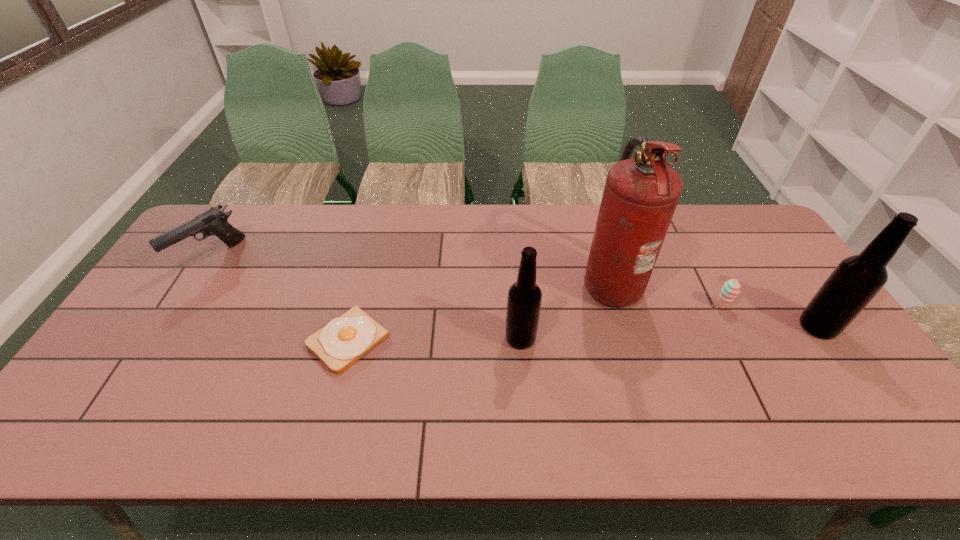
The image size is (960, 540). Find the location of `vacant region between the third tallest object and the fifth object from left to right`. vacant region between the third tallest object and the fifth object from left to right is located at coordinates (621, 322).

Image resolution: width=960 pixels, height=540 pixels. Find the location of `empty location between the toast and the third shortest object`. empty location between the toast and the third shortest object is located at coordinates (279, 299).

Locate an element on the screen. free space between the left beer bottle and the third shortest object is located at coordinates (366, 298).

The width and height of the screenshot is (960, 540). In order to click on vacant area that lies between the left beer bottle and the shortest object in this screenshot , I will do `click(434, 340)`.

Find the location of a particular element. Image resolution: width=960 pixels, height=540 pixels. free space between the tallest object and the left beer bottle is located at coordinates (565, 310).

Identify which object is located as the third nearest to the shorter beer bottle. Please provide its 2D coordinates. Your answer should be formatted as a tuple, i.e. [(x, y)], where the tuple contains the x and y coordinates of a point satisfying the conditions above.

[(730, 290)]

Locate which object is the fourth closest to the right beer bottle. Please provide its 2D coordinates. Your answer should be formatted as a tuple, i.e. [(x, y)], where the tuple contains the x and y coordinates of a point satisfying the conditions above.

[(344, 340)]

Where is `vacant position in the image that satisfies the following two spatial constraints: 1. at the front of the second tallest object where the nozzle is aimed; 2. on the right side of the fire extinguisher`? The height and width of the screenshot is (540, 960). vacant position in the image that satisfies the following two spatial constraints: 1. at the front of the second tallest object where the nozzle is aimed; 2. on the right side of the fire extinguisher is located at coordinates (623, 327).

Image resolution: width=960 pixels, height=540 pixels. I want to click on blank space that satisfies the following two spatial constraints: 1. at the front of the taller beer bottle where the nozzle is aimed; 2. on the right side of the fire extinguisher, so click(623, 327).

Locate an element on the screen. The width and height of the screenshot is (960, 540). vacant area that satisfies the following two spatial constraints: 1. at the front of the second tallest object where the nozzle is aimed; 2. on the left side of the tallest object is located at coordinates tap(623, 327).